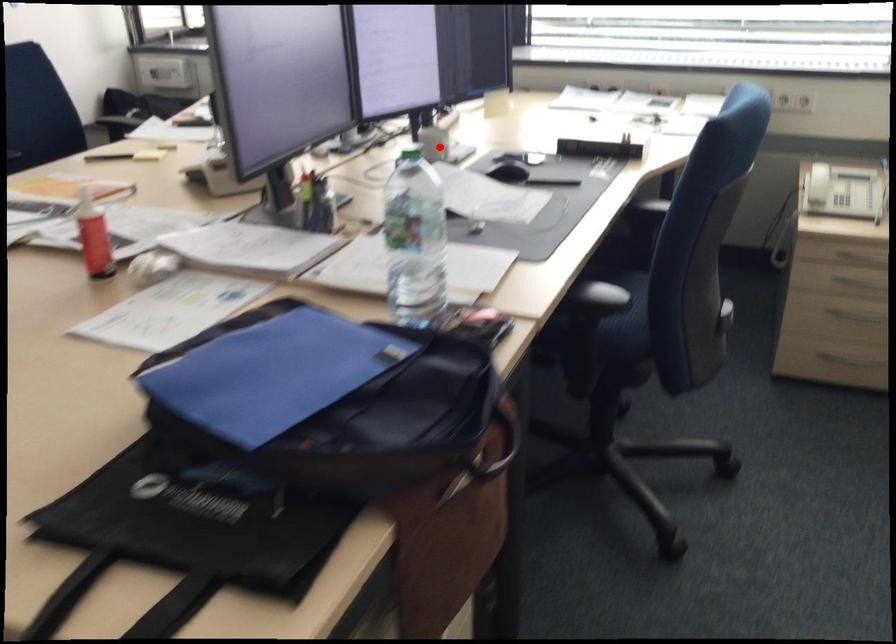
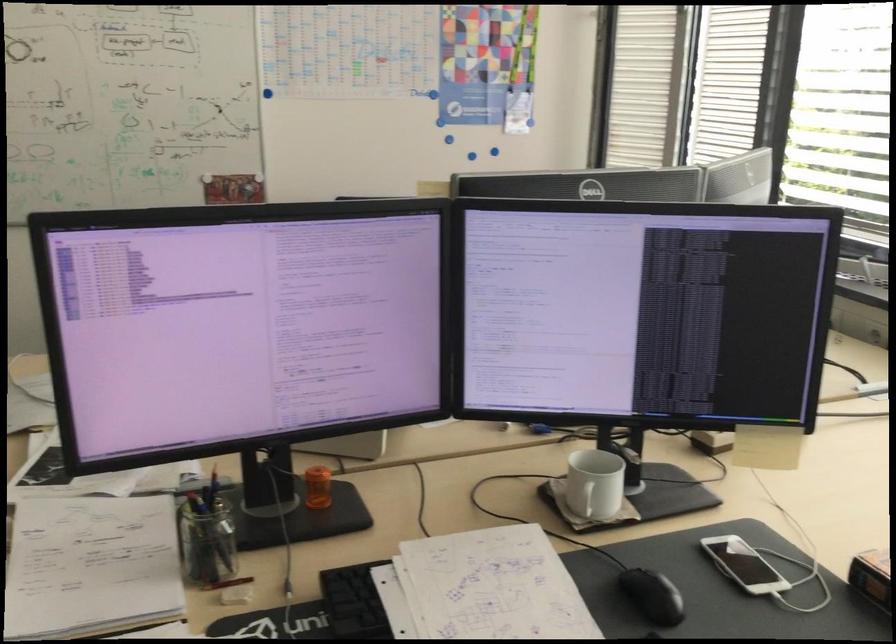
Question: I am providing you with two images of the same scene from different viewpoints. Image1 has a red point marked. In image2, the corresponding 3D location appears at what relative position? Reply with the corresponding letter.

Choices:
 (A) Closer
 (B) Farther

Answer: (A)